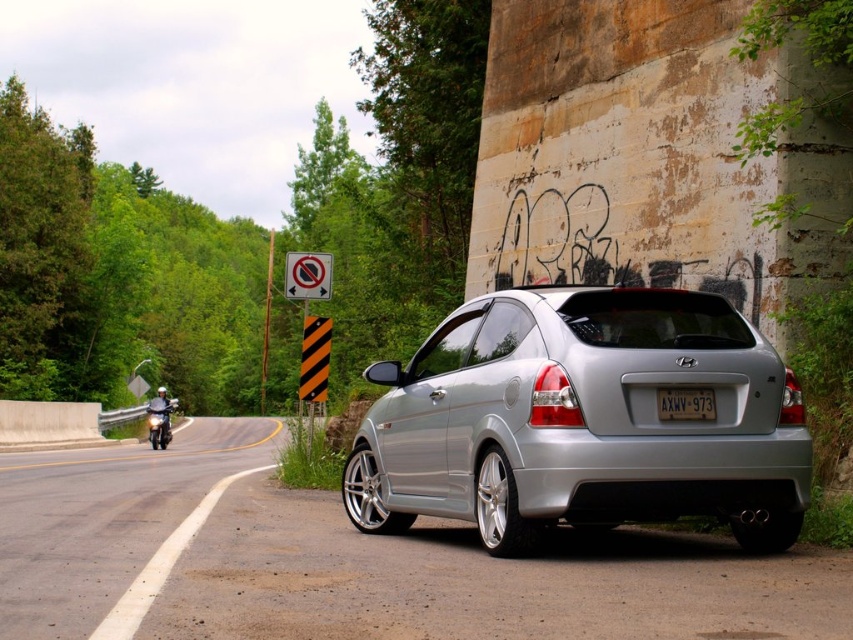
You are a delivery driver who needs to park your vehicle in the parking lot behind the satin silver hatchback at center and the white plastic sign at upper center. Can your truck, which is 2 meters wide, fit through the space between them?

The satin silver hatchback at center is thinner than the white plastic sign at upper center. Since the truck is 2 meters wide, we need to check the narrowest point between the two objects. However, the description only states the hatchback is thinner than the sign but doesn not provide exact measurements. Without knowing the actual width of the hatchback or the sign, it is impossible to determine if the truck can fit through the space between them.